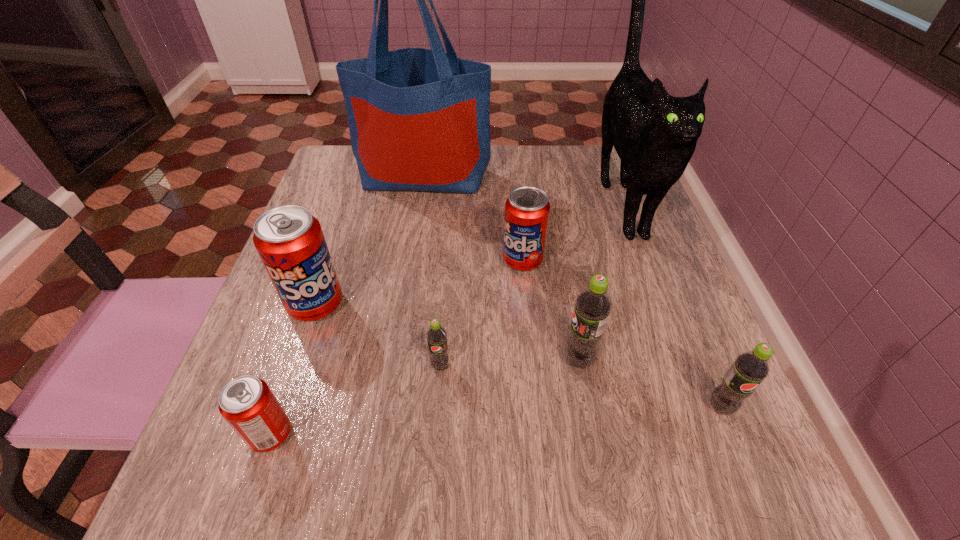
Where is `empty space between the rightmost soda can and the second biggest red soda can`? empty space between the rightmost soda can and the second biggest red soda can is located at coordinates (622, 334).

The width and height of the screenshot is (960, 540). Identify the location of free space between the smallest green soda and the second farthest red soda can. (378, 335).

Where is `vacant area between the second nearest red soda can and the fourth soda can from right to left`? The image size is (960, 540). vacant area between the second nearest red soda can and the fourth soda can from right to left is located at coordinates (378, 335).

Find the location of a particular element. Image resolution: width=960 pixels, height=540 pixels. empty space between the farthest soda can and the second smallest green soda is located at coordinates (622, 334).

The image size is (960, 540). I want to click on empty space that is in between the black cat and the smallest red soda can, so click(445, 317).

This screenshot has height=540, width=960. I want to click on blank region between the handbag and the smallest green soda, so click(432, 271).

Image resolution: width=960 pixels, height=540 pixels. Identify the location of empty location between the leftmost green soda and the red handbag. [432, 271].

Identify the location of vacant area between the nearest red soda can and the black cat. (445, 317).

Locate an element on the screen. This screenshot has height=540, width=960. object that is the fourth closest to the nearest red soda can is located at coordinates (527, 209).

Identify which object is located as the fifth nearest to the fifth object from left to right. Please provide its 2D coordinates. Your answer should be formatted as a tuple, i.e. [(x, y)], where the tuple contains the x and y coordinates of a point satisfying the conditions above.

[(290, 242)]